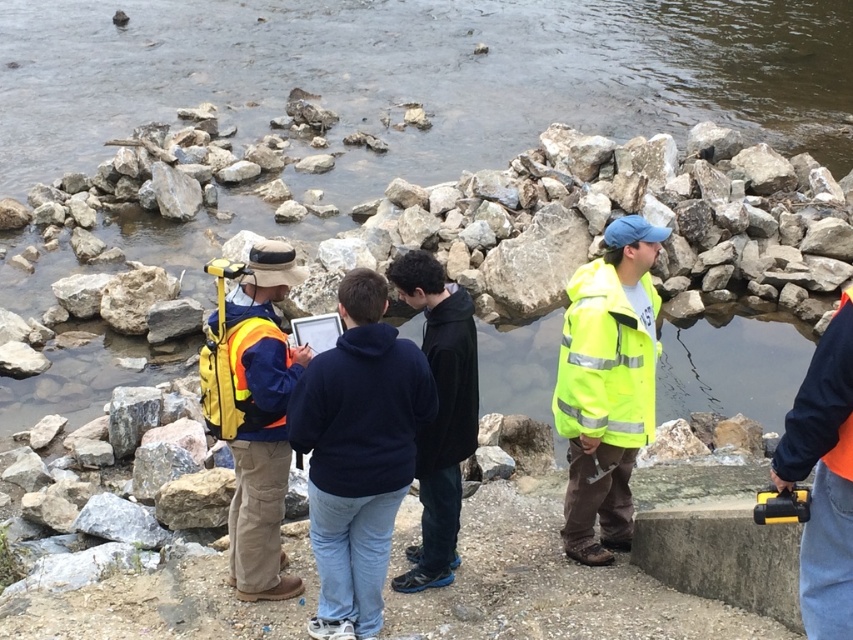
Question: Where is dark blue fleece at center located in relation to high-visibility yellow jacket at center-right in the image?

Choices:
 (A) right
 (B) left

Answer: (B)

Question: Does dark blue fleece at center have a lesser width compared to yellow plastic tool at lower right?

Choices:
 (A) yes
 (B) no

Answer: (B)

Question: Which object appears farthest from the camera in this image?

Choices:
 (A) dark blue fleece at center
 (B) yellow plastic tool at lower right
 (C) yellow reflective vest at center

Answer: (A)

Question: Is yellow reflective vest at center to the right of black matte jacket at center from the viewer's perspective?

Choices:
 (A) no
 (B) yes

Answer: (B)

Question: Which object is farther from the camera taking this photo?

Choices:
 (A) smooth stone stream at center
 (B) high-visibility yellow jacket at center-right

Answer: (A)

Question: Which object appears closest to the camera in this image?

Choices:
 (A) black matte jacket at center
 (B) dark blue fleece at center
 (C) high-visibility yellow safety vest at center-left
 (D) high-visibility yellow jacket at center-right

Answer: (B)